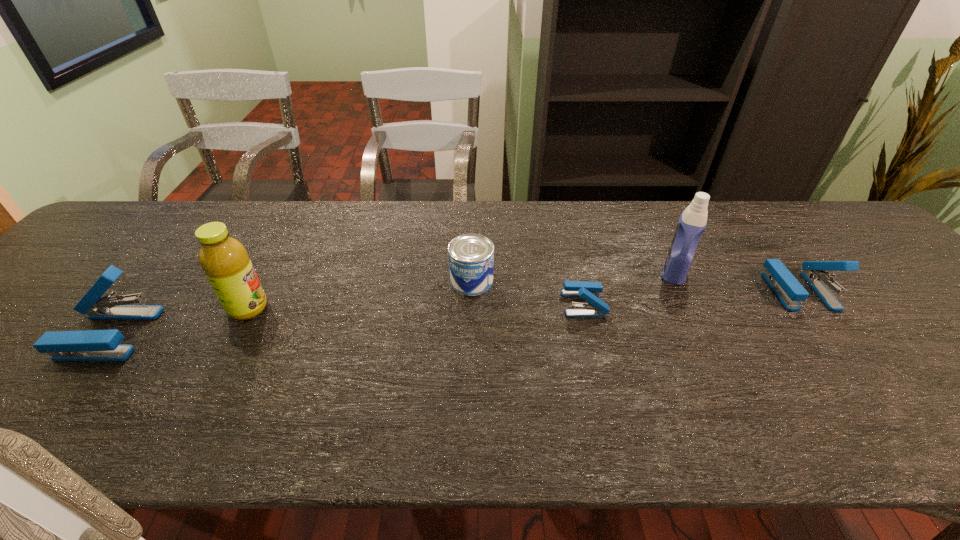
The image size is (960, 540). What are the coordinates of `vacant region located 0.270m on the left of the rightmost stapler` in the screenshot? It's located at (664, 291).

At what (x,y) coordinates should I click in order to perform the action: click on vacant space located on the front label of the can. Please return your answer as a coordinate pair (x, y). Looking at the image, I should click on (516, 281).

What are the coordinates of `free space located 0.320m on the front label of the second object from left to right` in the screenshot? It's located at (401, 308).

In order to click on free location located 0.060m on the front of the fifth object from left to right in this screenshot , I will do `click(690, 303)`.

Where is `free location at the far edge`? free location at the far edge is located at coordinates (x=218, y=201).

Find the location of a particular element. free space at the near edge is located at coordinates (88, 379).

Identify the location of vacant position at the left edge of the desktop. The image size is (960, 540). (19, 352).

I want to click on vacant space at the right edge, so click(x=950, y=316).

Locate an element on the screen. The image size is (960, 540). vacant space at the far left corner of the desktop is located at coordinates (156, 223).

Image resolution: width=960 pixels, height=540 pixels. Find the location of `free point between the fifth object from right to left and the rightmost stapler`. free point between the fifth object from right to left and the rightmost stapler is located at coordinates (523, 299).